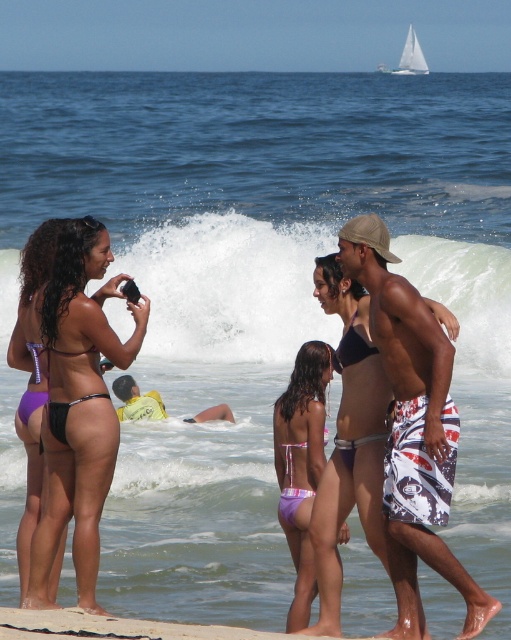
Measure the distance between yellow fabric shirt at lower center and black matte bikini at center.

7.23 meters

Does yellow fabric shirt at lower center have a smaller size compared to black matte bikini at center?

No, yellow fabric shirt at lower center is not smaller than black matte bikini at center.

This screenshot has height=640, width=511. I want to click on yellow fabric shirt at lower center, so click(x=136, y=401).

Does matte black bikini at center appear under black matte bikini at center?

Yes, matte black bikini at center is below black matte bikini at center.

Is matte black bikini at center further to the viewer compared to black matte bikini at center?

No, matte black bikini at center is in front of black matte bikini at center.

Image resolution: width=511 pixels, height=640 pixels. Describe the element at coordinates (356, 388) in the screenshot. I see `matte black bikini at center` at that location.

Where is `matte black bikini at center`? Image resolution: width=511 pixels, height=640 pixels. matte black bikini at center is located at coordinates (356, 388).

Can you confirm if purple shiny bikini at center is positioned to the right of purple matte bikini at left?

Yes, purple shiny bikini at center is to the right of purple matte bikini at left.

At what (x,y) coordinates should I click in order to perform the action: click on purple shiny bikini at center. Please return your answer as a coordinate pair (x, y). Looking at the image, I should click on (291, 486).

Who is more forward, (x=289, y=524) or (x=43, y=403)?

Point (x=289, y=524)

Locate an element on the screen. purple shiny bikini at center is located at coordinates (291, 486).